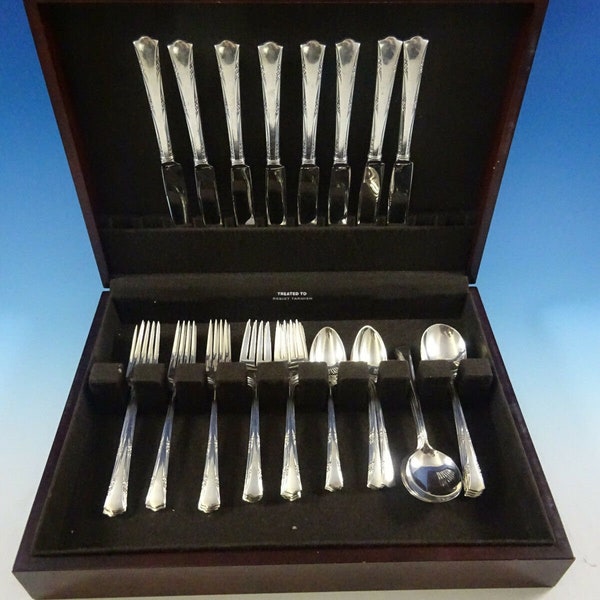
Locate an element on the screen. Image resolution: width=600 pixels, height=600 pixels. forks is located at coordinates (145, 357), (183, 347), (218, 348), (264, 340), (288, 341).